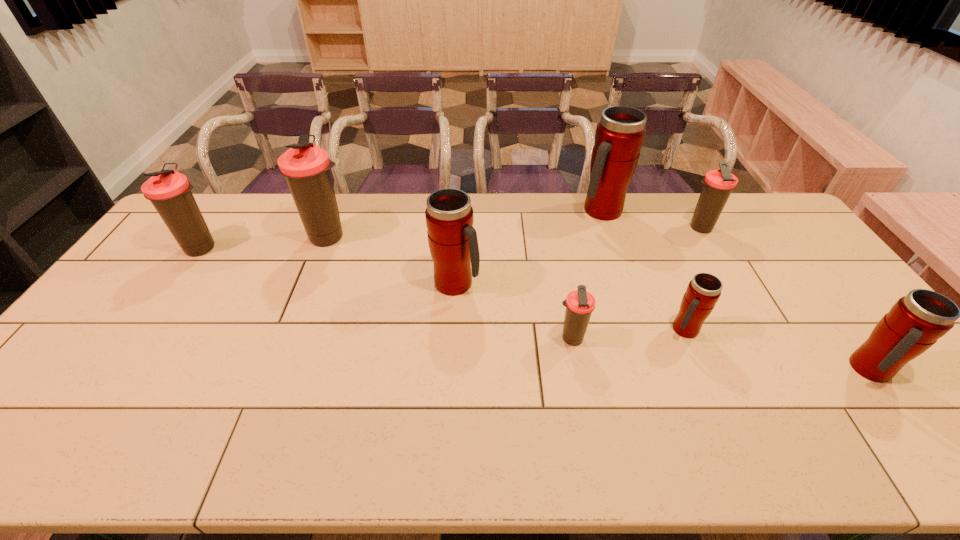
Where is `free spot between the third nearest red thermos bottle and the rightmost brown thermos bottle`? The image size is (960, 540). free spot between the third nearest red thermos bottle and the rightmost brown thermos bottle is located at coordinates tap(578, 256).

This screenshot has width=960, height=540. I want to click on free space between the third smallest brown thermos bottle and the second biggest red thermos bottle, so click(x=329, y=266).

You are a GUI agent. You are given a task and a screenshot of the screen. Output one action in this format:
    pyautogui.click(x=<x>, y=<y>)
    Task: Click on the vacant area between the second thermos bottle from right to left and the fourth thermos bottle from left to right
    Image resolution: width=960 pixels, height=540 pixels.
    Given the screenshot: What is the action you would take?
    pyautogui.click(x=636, y=284)

Locate an element on the screen. free space between the third smallest red thermos bottle and the farthest red thermos bottle is located at coordinates (529, 247).

Identify the location of unoccupied position between the smallest red thermos bottle and the fifth object from right to left. This screenshot has height=540, width=960. (628, 334).

Locate which object ranks fourth in proximity to the rightmost object. Please provide its 2D coordinates. Your answer should be formatted as a tuple, i.e. [(x, y)], where the tuple contains the x and y coordinates of a point satisfying the conditions above.

[(620, 133)]

The image size is (960, 540). Identify the location of the seventh closest object to the second object from right to left. (169, 191).

Find the location of `thermos bottle that is the nearest to the second smallest brown thermos bottle`. thermos bottle that is the nearest to the second smallest brown thermos bottle is located at coordinates (620, 133).

Identify the location of thermos bottle that is the sixth nearest to the smallest red thermos bottle. The width and height of the screenshot is (960, 540). (306, 167).

Identify which red thermos bottle is the third nearest to the farthest red thermos bottle. Please provide its 2D coordinates. Your answer should be formatted as a tuple, i.e. [(x, y)], where the tuple contains the x and y coordinates of a point satisfying the conditions above.

[(916, 321)]